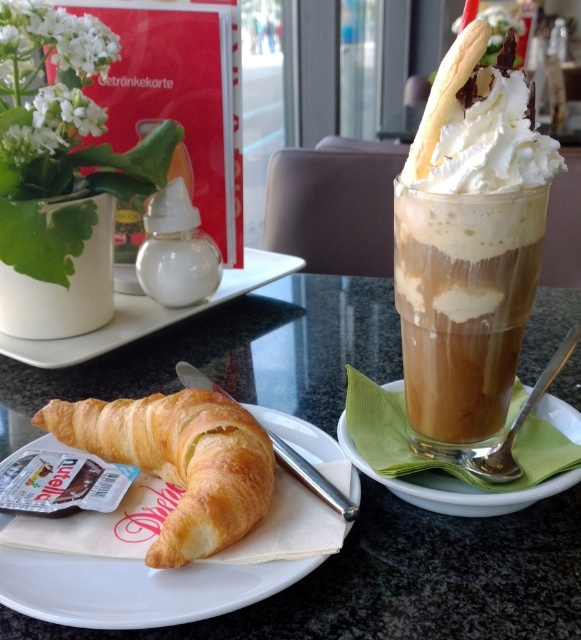
You are a barista preparing a customer order. The customer wants to place their caramel frosted glass at right and white ceramic plate at upper center on the counter. The counter has a 12 inch width. Can both items fit side by side without overlapping?

The caramel frosted glass at right is 12.66 inches from the white ceramic plate at upper center. Since the distance between them is greater than the counter width of 12 inches, they cannot fit side by side without overlapping.

What is the object located at the coordinates point (464, 307)?

The object located at point (464, 307) is the caramel frosted glass at right.

You are a customer sitting at the table and want to reach both the golden brown flaky croissant at lower left and the golden brown croissant at center. Which croissant will you grab first if you want to take the one closer to you?

You should grab the golden brown flaky croissant at lower left first because it is closer to you than the golden brown croissant at center.